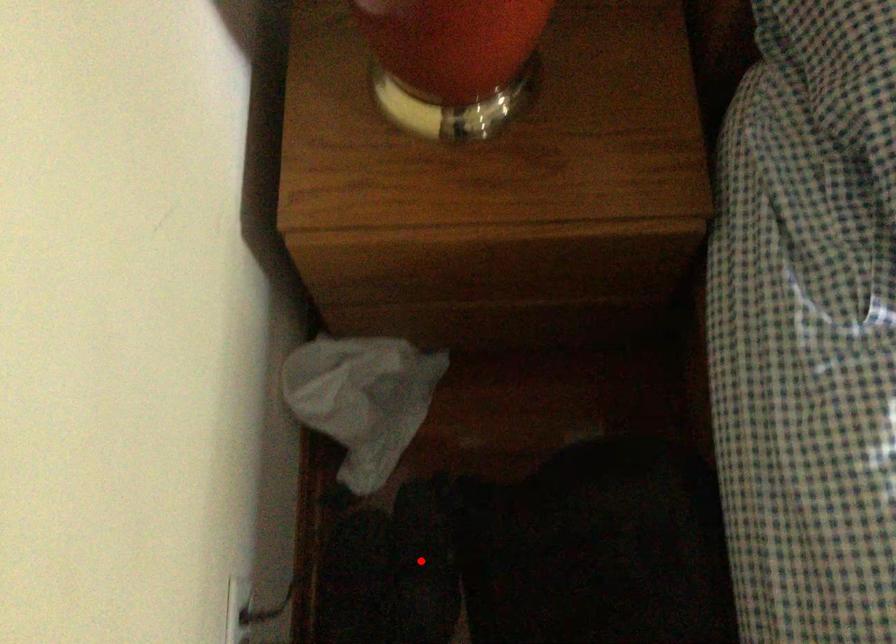
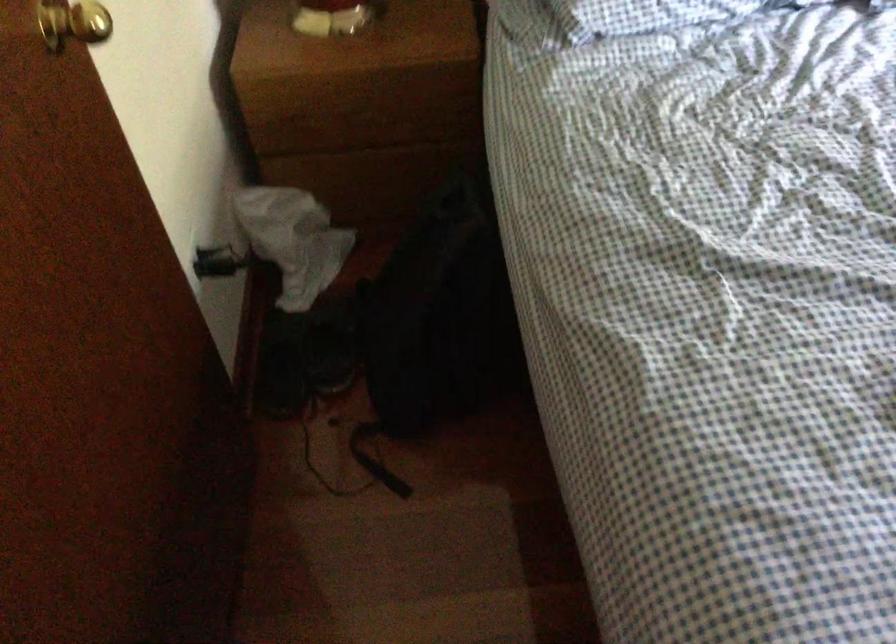
Question: A red point is marked in image1. In image2, is the corresponding 3D point closer to the camera or farther? Reply with the corresponding letter.

Choices:
 (A) The corresponding 3D point is closer.
 (B) The corresponding 3D point is farther.

Answer: (B)